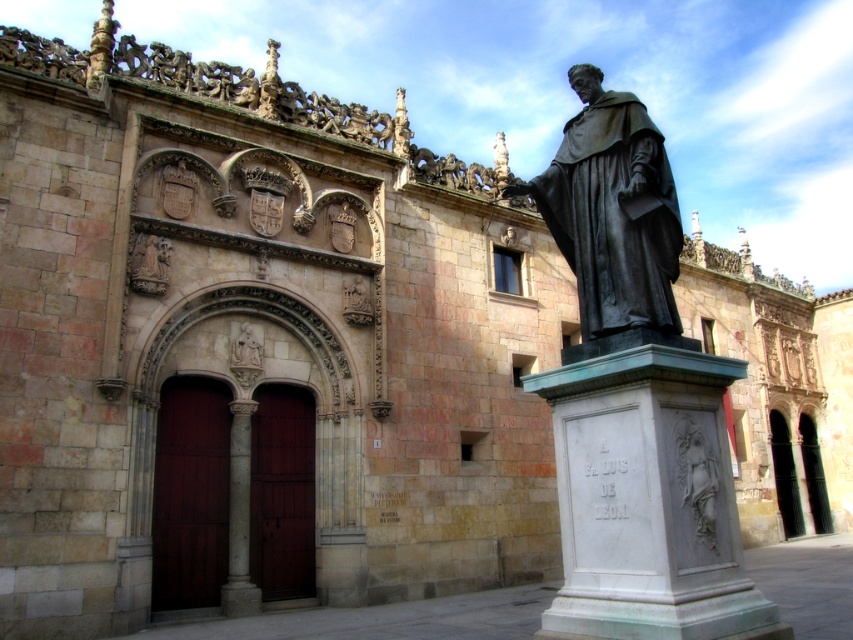
Who is higher up, white marble pedestal at center or polished stone relief at center?

polished stone relief at center

Is white marble pedestal at center behind polished stone relief at center?

No, white marble pedestal at center is in front of polished stone relief at center.

Describe the element at coordinates (647, 493) in the screenshot. The image size is (853, 640). I see `white marble pedestal at center` at that location.

Image resolution: width=853 pixels, height=640 pixels. Find the location of `white marble pedestal at center`. white marble pedestal at center is located at coordinates (647, 493).

Can you confirm if bronze/statue at right is wider than dark gray stone relief at center?

Yes, bronze/statue at right is wider than dark gray stone relief at center.

In order to click on bronze/statue at right in this screenshot , I will do `click(614, 216)`.

This screenshot has width=853, height=640. Identify the location of bronze/statue at right. (614, 216).

You are a GUI agent. You are given a task and a screenshot of the screen. Output one action in this format:
    pyautogui.click(x=<x>, y=<y>)
    Task: Click on the bronze/statue at right
    The image size is (853, 640).
    Given the screenshot: What is the action you would take?
    pyautogui.click(x=614, y=216)

The width and height of the screenshot is (853, 640). What do you see at coordinates (697, 481) in the screenshot?
I see `dark gray stone relief at center` at bounding box center [697, 481].

Who is more forward, (706, 448) or (236, 362)?

Point (706, 448) is in front.

Where is `dark gray stone relief at center`? dark gray stone relief at center is located at coordinates (697, 481).

Find the location of `dark gray stone relief at center`. dark gray stone relief at center is located at coordinates (697, 481).